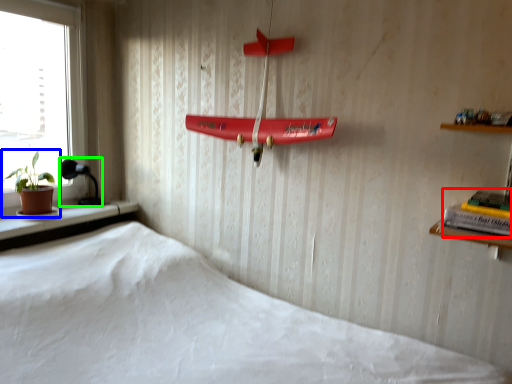
Question: Which is farther away from book (highlighted by a red box)? houseplant (highlighted by a blue box) or lamp (highlighted by a green box)?

Choices:
 (A) houseplant
 (B) lamp

Answer: (B)